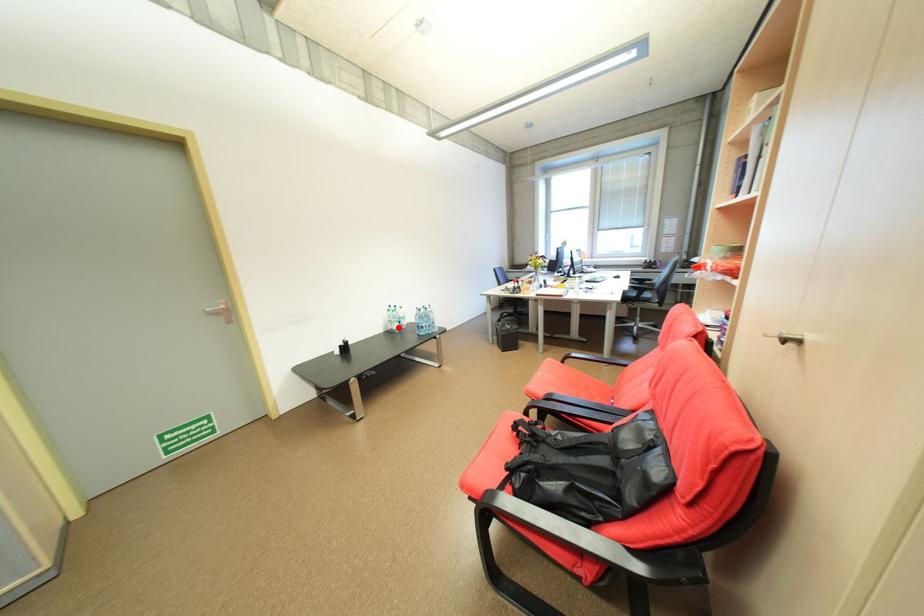
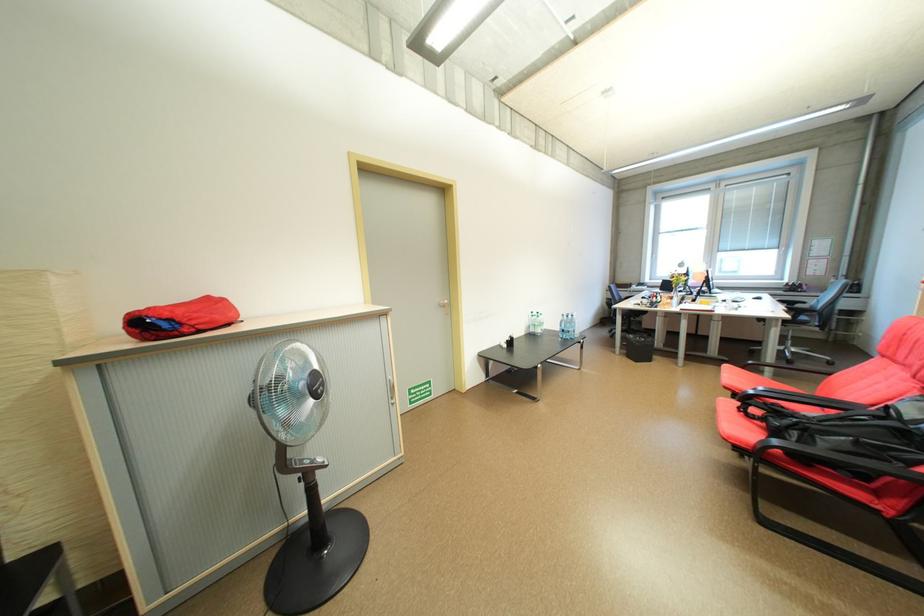
Locate, in the second image, the point that corresponds to the highlighted location in the first image.

(541, 331)